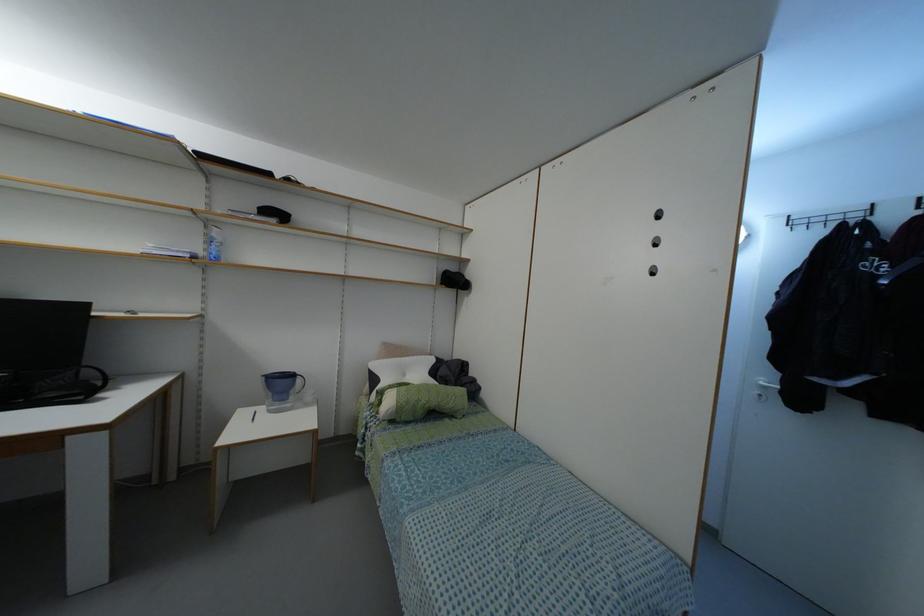
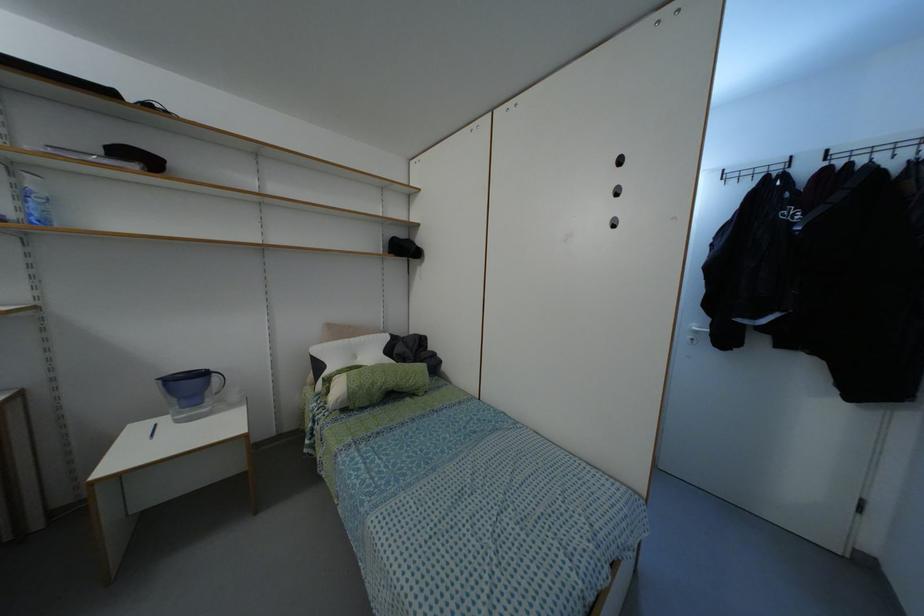
Locate, in the second image, the point that corresponds to (216,257) in the first image.

(44, 222)